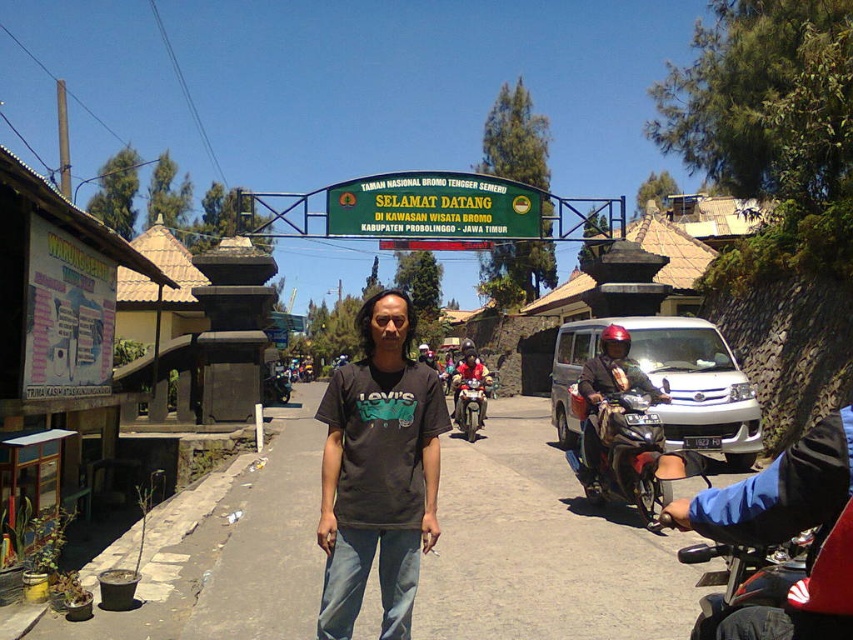
Question: Is matte black helmet at upper center bigger than metallic silver motorcycle at center?

Choices:
 (A) no
 (B) yes

Answer: (B)

Question: Can you confirm if green plastic signboard at center is positioned above metallic silver motorcycle at center?

Choices:
 (A) no
 (B) yes

Answer: (B)

Question: Which object is farther from the camera taking this photo?

Choices:
 (A) matte black helmet at upper center
 (B) silver metallic van at center-right
 (C) metallic silver scooter at right

Answer: (B)

Question: Estimate the real-world distances between objects in this image. Which object is farther from the silver metallic van at center-right?

Choices:
 (A) green plastic signboard at center
 (B) dark gray cotton t-shirt at center
 (C) metallic silver scooter at right
 (D) metallic silver motorcycle at center

Answer: (A)

Question: Which point is farther to the camera?

Choices:
 (A) (605, 356)
 (B) (468, 403)

Answer: (B)

Question: Does dark gray cotton t-shirt at center lie behind matte black helmet at upper center?

Choices:
 (A) yes
 (B) no

Answer: (B)